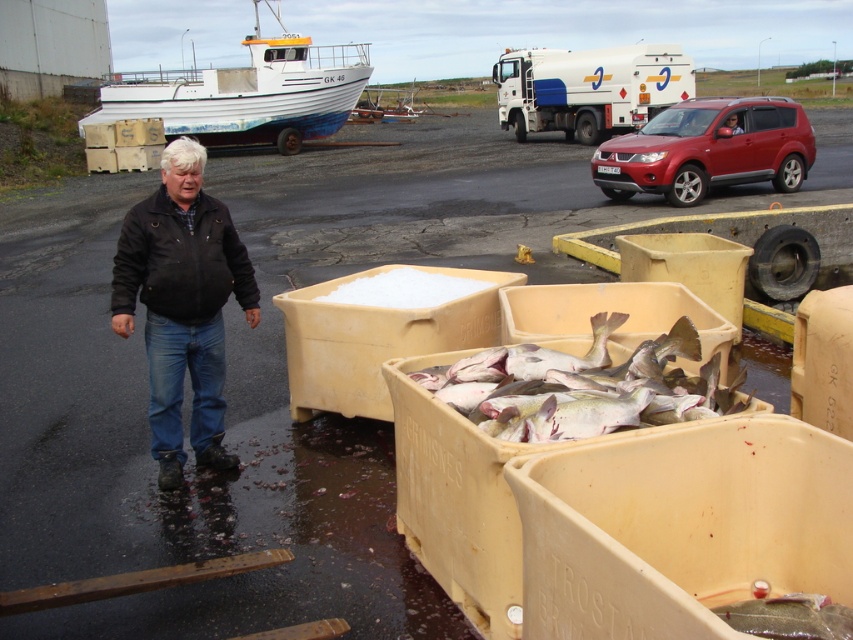
You are standing at the point with coordinates point [244,125] and want to walk towards the point with coordinates point [430,387]. Which direction should you move relative to your current position?

You should move forward because point [430,387] is in front of point [244,125].

You are a food inspector checking the freshness of the fish in the yellow plastic containers. You notice the pale pink flesh at center and the white painted wood boat at upper left. Which object is positioned lower in the image?

The pale pink flesh at center is positioned lower than the white painted wood boat at upper left in the image.

You are a worker in the fishing area and need to move the pale pink flesh at center to the left side. Can you move it past the black leather jacket at left without moving the jacket?

The black leather jacket at left is to the left of pale pink flesh at center. Since the jacket is already positioned to the left of the flesh, moving the pale pink flesh at center to the left side would require moving it past the jacket, but since the jacket is an object in the scene, you cannot move it. Therefore, you cannot move the pale pink flesh at center past the black leather jacket at left without moving the jacket itself.